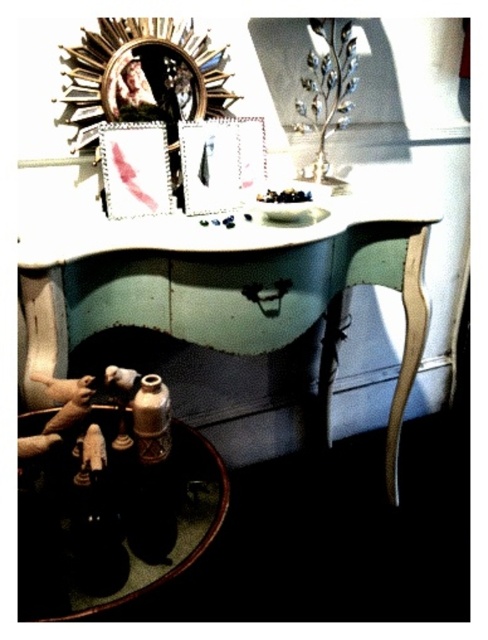
Question: Can you confirm if matte white vanity at center is thinner than matte black picture frame at center?

Choices:
 (A) no
 (B) yes

Answer: (A)

Question: Which is farther from the metallic silver picture frame at upper center?

Choices:
 (A) matte black picture frame at center
 (B) shiny brown wood at lower left

Answer: (B)

Question: Does shiny brown wood at lower left appear over matte black picture frame at center?

Choices:
 (A) yes
 (B) no

Answer: (B)

Question: Does matte black picture frame at center appear on the right side of metallic silver picture frame at upper center?

Choices:
 (A) yes
 (B) no

Answer: (A)

Question: Which point appears farthest from the camera in this image?

Choices:
 (A) (161, 140)
 (B) (256, 177)
 (C) (42, 465)

Answer: (B)

Question: Which object is positioned farthest from the matte black picture frame at center?

Choices:
 (A) shiny brown wood at lower left
 (B) metallic silver picture frame at upper center
 (C) matte white vanity at center

Answer: (A)